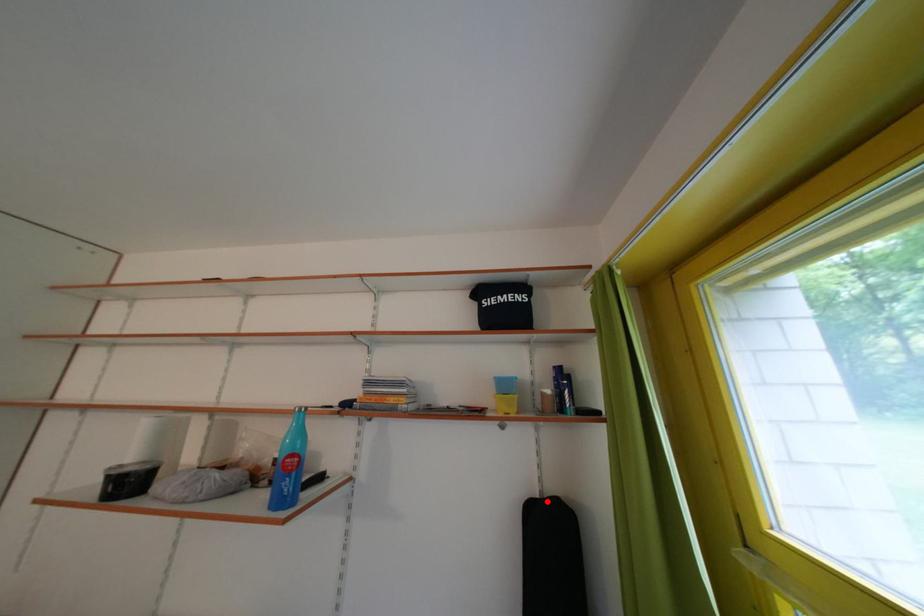
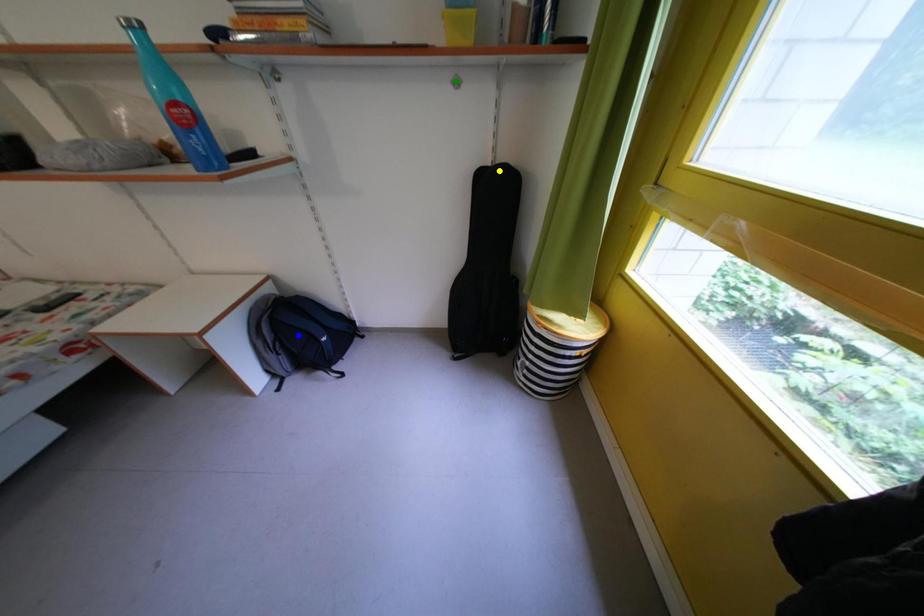
Question: I am providing you with two images of the same scene from different viewpoints. A red point is marked on the first image. You are given multiple points on the second image. Can you choose the point in image 2 that corresponds to the point in image 1?

Choices:
 (A) yellow point
 (B) blue point
 (C) green point

Answer: (A)